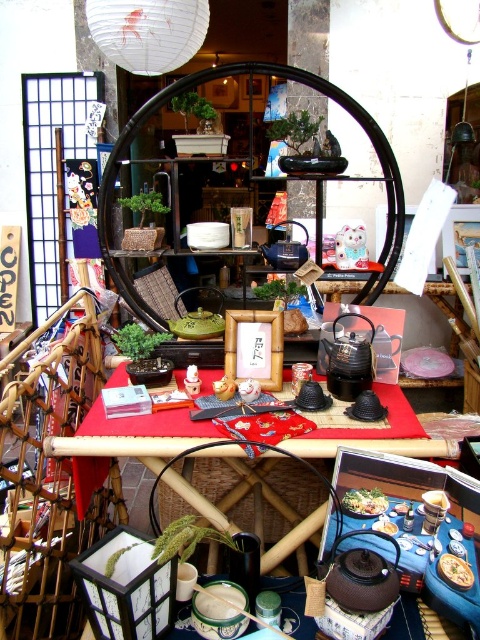
Locate an element on the screen. The height and width of the screenshot is (640, 480). smooth white bowl at center is located at coordinates (363, 502).

Where is `smooth white bowl at center`? The height and width of the screenshot is (640, 480). smooth white bowl at center is located at coordinates (363, 502).

The image size is (480, 640). I want to click on smooth white bowl at center, so click(x=363, y=502).

Can you confirm if blue ceramic teapot at center is positioned below smooth white rice at center?

Answer: No.

How far apart are blue ceramic teapot at center and smooth white rice at center?

blue ceramic teapot at center is 1.45 meters from smooth white rice at center.

Which is in front, point (272, 252) or point (396, 502)?

Point (396, 502) is in front.

Where is `blue ceramic teapot at center`? Image resolution: width=480 pixels, height=640 pixels. blue ceramic teapot at center is located at coordinates (286, 250).

Does red fabric table at center appear over dark brown matte teapot at center?

Correct, red fabric table at center is located above dark brown matte teapot at center.

From the picture: Can you confirm if red fabric table at center is positioned below dark brown matte teapot at center?

No.

Is point (397, 448) in front of point (364, 573)?

That is False.

Locate an element on the screen. red fabric table at center is located at coordinates (212, 490).